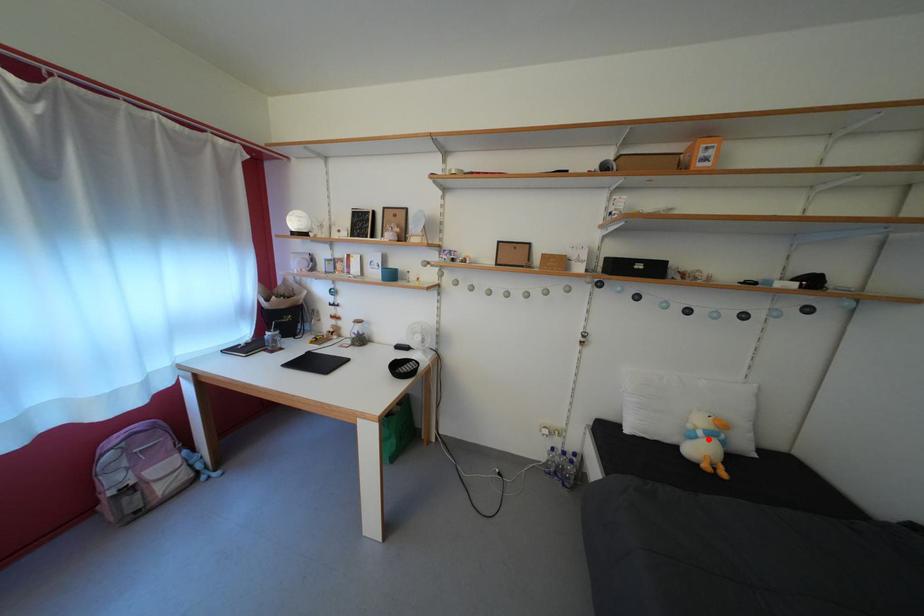
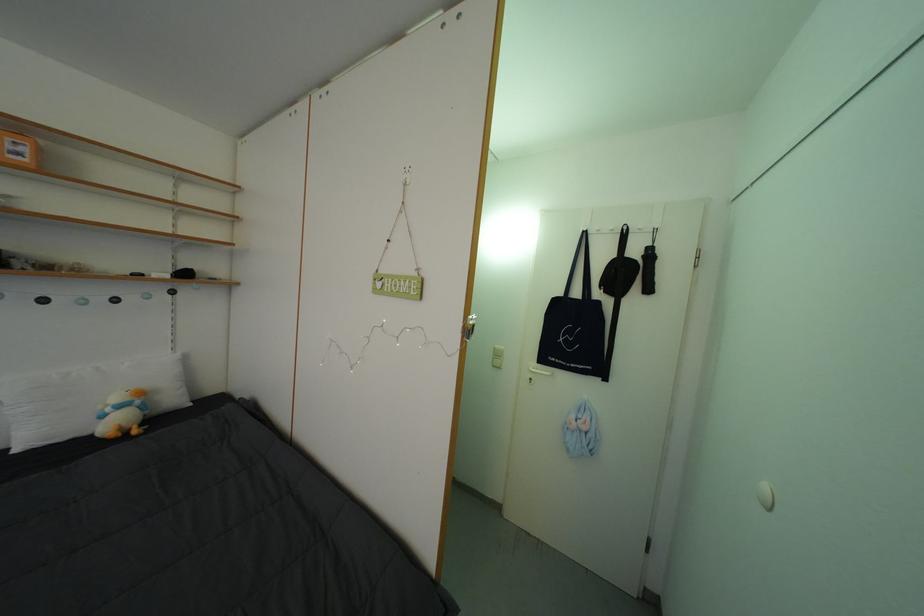
Question: I am providing you with two images of the same scene from different viewpoints. A red point is marked on the first image. Is the red point's position out of view in image 2?

Choices:
 (A) Yes
 (B) No

Answer: (B)